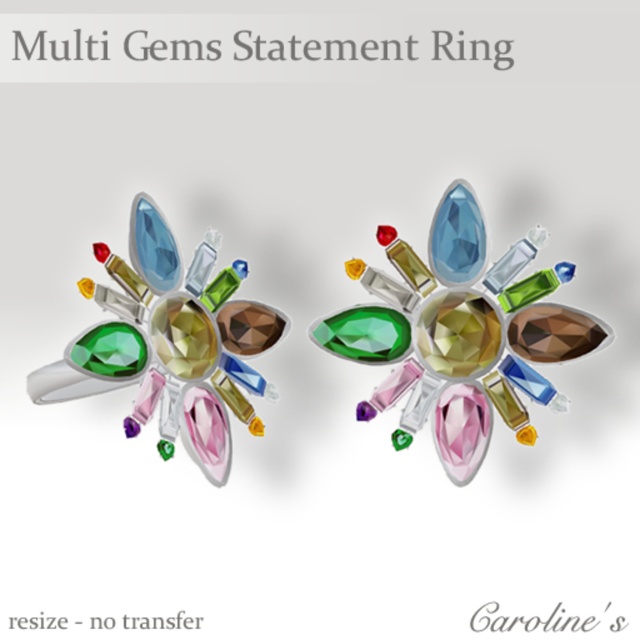
Question: Can you confirm if multicolored gemstone ring at center is positioned above matte silver ring at center?

Choices:
 (A) no
 (B) yes

Answer: (B)

Question: Observing the image, what is the correct spatial positioning of multicolored gemstone ring at center in reference to matte silver ring at center?

Choices:
 (A) right
 (B) left

Answer: (A)

Question: Is multicolored gemstone ring at center positioned in front of matte silver ring at center?

Choices:
 (A) yes
 (B) no

Answer: (A)

Question: Which point appears farthest from the camera in this image?

Choices:
 (A) click(232, 371)
 (B) click(500, 266)

Answer: (A)